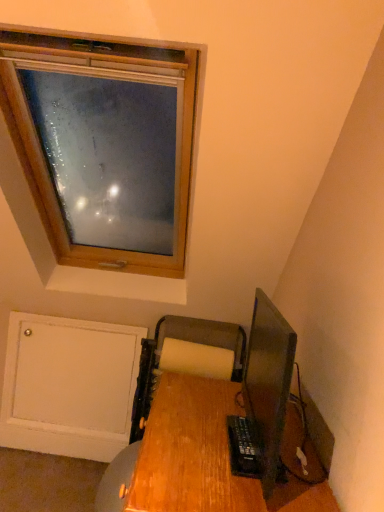
Where is `free space that is to the left of matte black monitor at lower right`? free space that is to the left of matte black monitor at lower right is located at coordinates (183, 441).